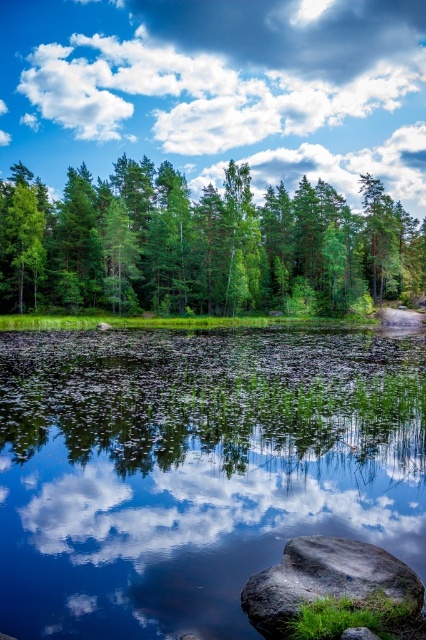
Does transparent glass lake at center have a greater height compared to white fluffy cloud at upper center?

In fact, transparent glass lake at center may be shorter than white fluffy cloud at upper center.

Does transparent glass lake at center appear under white fluffy cloud at upper center?

Yes, transparent glass lake at center is below white fluffy cloud at upper center.

In order to click on transparent glass lake at center in this screenshot , I will do `click(195, 468)`.

Find the location of a particular element. transparent glass lake at center is located at coordinates (195, 468).

Which is below, transparent glass lake at center or gray smooth rock at lower right?

gray smooth rock at lower right

Is point (396, 468) farther from camera compared to point (337, 593)?

Yes, it is behind point (337, 593).

The height and width of the screenshot is (640, 426). What are the coordinates of `transparent glass lake at center` in the screenshot? It's located at (195, 468).

Between transparent glass lake at center and green leafy trees at center, which one appears on the left side from the viewer's perspective?

Positioned to the left is transparent glass lake at center.

Measure the distance between transparent glass lake at center and green leafy trees at center.

They are 47.42 meters apart.

Does point (218, 358) come in front of point (49, 241)?

Yes.

Locate an element on the screen. transparent glass lake at center is located at coordinates click(195, 468).